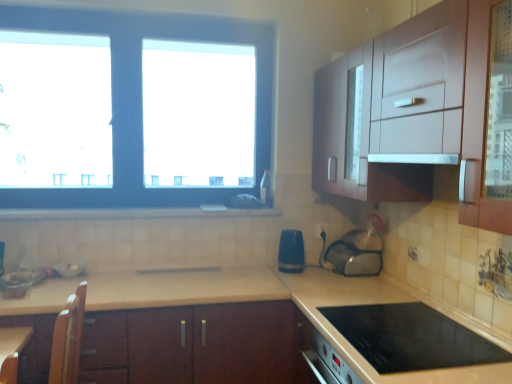
Where is `vacant area on top of blue matte window at upper left (from a real-world perspective)`? Image resolution: width=512 pixels, height=384 pixels. vacant area on top of blue matte window at upper left (from a real-world perspective) is located at coordinates (133, 10).